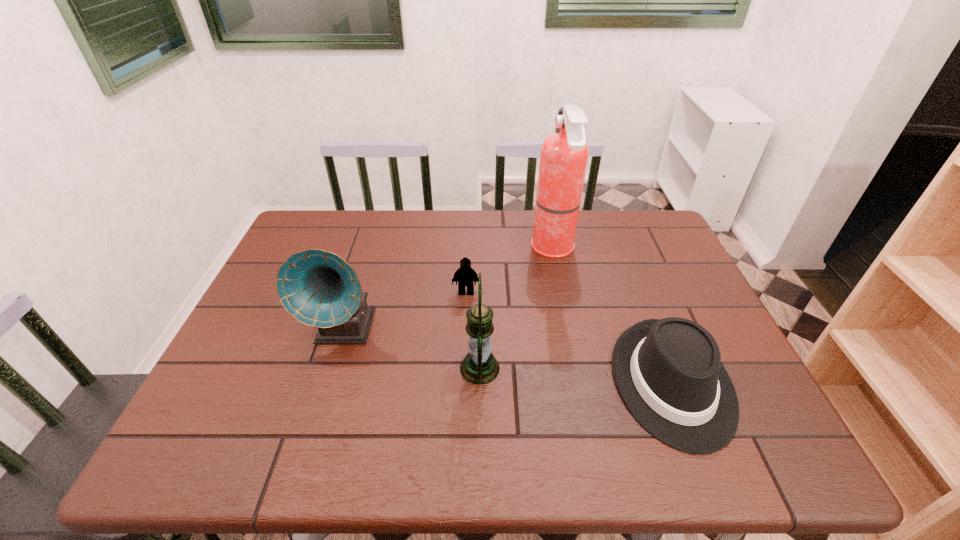
Where is `free spot between the lantern and the fedora`? This screenshot has height=540, width=960. free spot between the lantern and the fedora is located at coordinates (576, 375).

Identify which object is the fourth nearest to the second object from right to left. Please provide its 2D coordinates. Your answer should be formatted as a tuple, i.e. [(x, y)], where the tuple contains the x and y coordinates of a point satisfying the conditions above.

[(319, 288)]

Select which object is the second closest to the leftmost object. Please provide its 2D coordinates. Your answer should be formatted as a tuple, i.e. [(x, y)], where the tuple contains the x and y coordinates of a point satisfying the conditions above.

[(479, 366)]

Locate an element on the screen. This screenshot has height=540, width=960. vacant space that satisfies the following two spatial constraints: 1. with the handle and hose on the fourth object from left to right; 2. on the face of the second farthest object is located at coordinates (563, 292).

What are the coordinates of `free space that satisfies the following two spatial constraints: 1. with the handle and hose on the farthest object; 2. on the face of the fourth nearest object` in the screenshot? It's located at (563, 292).